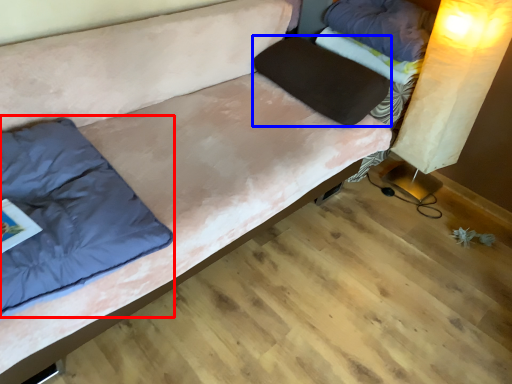
Question: Which object is further to the camera taking this photo, pillow (highlighted by a red box) or pillow (highlighted by a blue box)?

Choices:
 (A) pillow
 (B) pillow

Answer: (B)